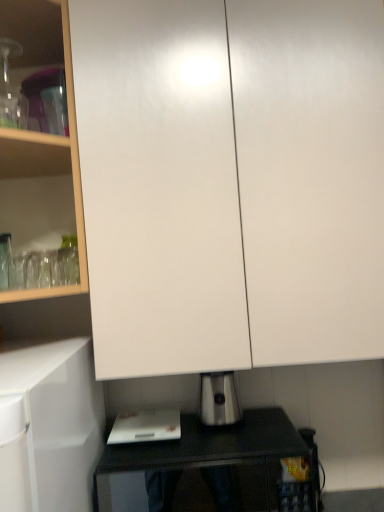
Question: From the image's perspective, is white plastic cutting board at lower center positioned above or below white glossy cabinet at upper center?

Choices:
 (A) above
 (B) below

Answer: (B)

Question: In terms of size, does white plastic cutting board at lower center appear bigger or smaller than white glossy cabinet at upper center?

Choices:
 (A) big
 (B) small

Answer: (B)

Question: Estimate the real-world distances between objects in this image. Which object is farther from the satin silver toaster at lower center?

Choices:
 (A) white glossy cabinet at upper center
 (B) white plastic cutting board at lower center
 (C) white glossy cabinet at upper left
 (D) black glossy table at lower center

Answer: (C)

Question: Based on their relative distances, which object is nearer to the white plastic cutting board at lower center?

Choices:
 (A) white glossy cabinet at upper left
 (B) black glossy table at lower center
 (C) white glossy cabinet at upper center
 (D) satin silver toaster at lower center

Answer: (B)